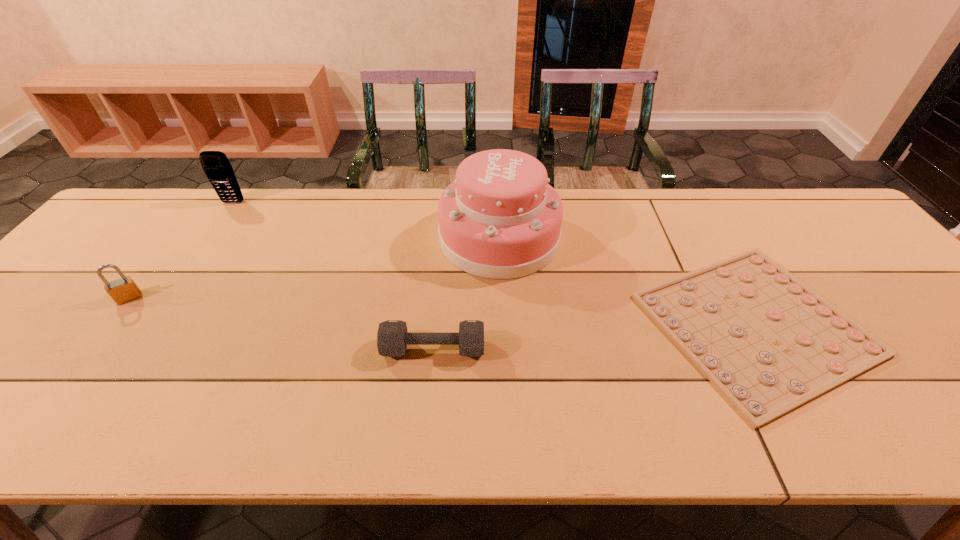
Locate an element on the screen. Image resolution: width=960 pixels, height=540 pixels. the tallest object is located at coordinates (500, 219).

This screenshot has width=960, height=540. Find the location of `the second object from left to right`. the second object from left to right is located at coordinates (216, 166).

Where is `the second tallest object`? The height and width of the screenshot is (540, 960). the second tallest object is located at coordinates (216, 166).

This screenshot has width=960, height=540. In order to click on the third tallest object in this screenshot , I will do `click(122, 290)`.

The image size is (960, 540). What are the coordinates of `padlock` in the screenshot? It's located at (122, 290).

What are the coordinates of `the second shortest object` in the screenshot? It's located at (392, 337).

Identify the location of the shortest object. The height and width of the screenshot is (540, 960). (769, 343).

Identify the location of the rightmost object. (769, 343).

Identify the location of blank area located on the front of the tallest object. The width and height of the screenshot is (960, 540). (507, 403).

Identify the location of vacant space located 0.290m on the screen of the second object from left to right. (187, 271).